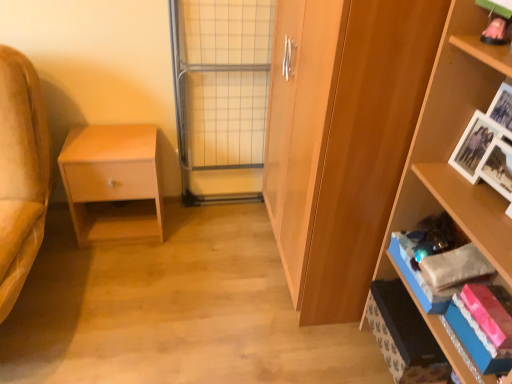
This screenshot has width=512, height=384. I want to click on wooden shelf at right, so click(454, 144).

What is the approximate width of wooden cabinet at center?

wooden cabinet at center is 22.06 inches wide.

What do you see at coordinates (342, 140) in the screenshot? I see `wooden cabinet at center` at bounding box center [342, 140].

Locate an element on the screen. The width and height of the screenshot is (512, 384). wooden shelf at right is located at coordinates (454, 144).

Is wooden cabinet at center touching metal grid screen door at center?

No, wooden cabinet at center is not next to metal grid screen door at center.

Consider the image. Between wooden cabinet at center and metal grid screen door at center, which one has more height?

With more height is wooden cabinet at center.

Considering the positions of points (338, 235) and (224, 65), is point (338, 235) farther from camera compared to point (224, 65)?

No.

Could you tell me if wooden cabinet at center is facing metal grid screen door at center?

Yes, wooden cabinet at center is oriented towards metal grid screen door at center.

From the image's perspective, is blue cardboard box at lower right under matte wood nightstand at left?

Yes, from the image's perspective, blue cardboard box at lower right is below matte wood nightstand at left.

Would you consider blue cardboard box at lower right to be distant from matte wood nightstand at left?

Yes, blue cardboard box at lower right is far from matte wood nightstand at left.

Does point (369, 303) come in front of point (99, 202)?

Yes, it is.

Can you tell me how much blue cardboard box at lower right and matte wood nightstand at left differ in facing direction?

The angular difference between blue cardboard box at lower right and matte wood nightstand at left is 89.9 degrees.

Would you consider blue cardboard box at lower right to be distant from shiny pink book at lower right?

No, blue cardboard box at lower right is not far away from shiny pink book at lower right.

From the picture: Between blue cardboard box at lower right and shiny pink book at lower right, which one is positioned behind?

Positioned behind is blue cardboard box at lower right.

This screenshot has height=384, width=512. Identify the location of book above the blue cardboard box at lower right (from a real-world perspective). (483, 327).

Is matte wood nightstand at left turned away from metal grid screen door at center?

No, matte wood nightstand at left is not facing the opposite direction of metal grid screen door at center.

From the image's perspective, which is above, matte wood nightstand at left or metal grid screen door at center?

From the image's view, metal grid screen door at center is above.

Which is more to the left, matte wood nightstand at left or metal grid screen door at center?

Positioned to the left is matte wood nightstand at left.

Which is nearer, (501, 362) or (406, 382)?

Positioned in front is point (501, 362).

From a real-world perspective, which object rests below the other?

blue cardboard box at lower right is physically lower.

Consider the image. Is shiny pink book at lower right spatially inside blue cardboard box at lower right, or outside of it?

shiny pink book at lower right is spatially situated outside blue cardboard box at lower right.

How many degrees apart are the facing directions of shiny pink book at lower right and blue cardboard box at lower right?

The angular difference between shiny pink book at lower right and blue cardboard box at lower right is 0.000143 degrees.

Is wooden cabinet at center facing towards wooden shelf at right?

No, wooden cabinet at center is not facing towards wooden shelf at right.

Which is more to the right, wooden cabinet at center or wooden shelf at right?

wooden shelf at right.

From a real-world perspective, is wooden cabinet at center on wooden shelf at right?

Incorrect, from a real-world perspective, wooden cabinet at center is lower than wooden shelf at right.

How many degrees apart are the facing directions of wooden cabinet at center and wooden shelf at right?

The facing directions of wooden cabinet at center and wooden shelf at right are 0.000163 degrees apart.

Is wooden shelf at right inside the boundaries of matte wood nightstand at left, or outside?

wooden shelf at right is spatially situated outside matte wood nightstand at left.

Between wooden shelf at right and matte wood nightstand at left, which one has larger width?

Wider between the two is matte wood nightstand at left.

Does point (419, 214) appear closer or farther from the camera than point (93, 129)?

Point (419, 214) is positioned closer to the camera compared to point (93, 129).

Considering the positions of objects wooden shelf at right and matte wood nightstand at left in the image provided, who is more to the left, wooden shelf at right or matte wood nightstand at left?

Positioned to the left is matte wood nightstand at left.

Find the location of a particular element. cabinetry that appears in front of the metal grid screen door at center is located at coordinates (342, 140).

At what (x,y) coordinates should I click in order to perform the action: click on cabinet below the matte wood nightstand at left (from the image's perspective). Please return your answer as a coordinate pair (x, y). This screenshot has height=384, width=512. Looking at the image, I should click on (404, 336).

In the scene shown: From the image, which object appears to be nearer to shiny pink book at lower right, wooden shelf at right or metal grid screen door at center?

Based on the image, wooden shelf at right appears to be nearer to shiny pink book at lower right.

Considering their positions, is blue cardboard box at lower right positioned further to wooden shelf at right than metal grid screen door at center?

metal grid screen door at center.

Estimate the real-world distances between objects in this image. Which object is closer to wooden cabinet at center, shiny pink book at lower right or matte wood nightstand at left?

Among the two, shiny pink book at lower right is located nearer to wooden cabinet at center.

Which object lies further to the anchor point metal grid screen door at center, wooden shelf at right or matte wood nightstand at left?

The object further to metal grid screen door at center is wooden shelf at right.

Based on their spatial positions, is matte wood nightstand at left or blue cardboard box at lower right further from metal grid screen door at center?

Among the two, blue cardboard box at lower right is located further to metal grid screen door at center.

From the image, which object appears to be farther from matte wood nightstand at left, wooden shelf at right or blue cardboard box at lower right?

The object further to matte wood nightstand at left is wooden shelf at right.

Based on their spatial positions, is shiny pink book at lower right or metal grid screen door at center further from blue cardboard box at lower right?

Based on the image, metal grid screen door at center appears to be further to blue cardboard box at lower right.

From the image, which object appears to be farther from metal grid screen door at center, blue cardboard box at lower right or wooden cabinet at center?

blue cardboard box at lower right lies further to metal grid screen door at center than the other object.

The height and width of the screenshot is (384, 512). In order to click on cabinetry between wooden shelf at right and blue cardboard box at lower right along the z-axis in this screenshot , I will do `click(342, 140)`.

Identify the location of book that lies between wooden cabinet at center and blue cardboard box at lower right from top to bottom. Image resolution: width=512 pixels, height=384 pixels. (483, 327).

Locate an element on the screen. screen door between wooden shelf at right and matte wood nightstand at left from front to back is located at coordinates (220, 88).

Where is `shelf between wooden cabinet at center and shiny pink book at lower right from top to bottom`? This screenshot has height=384, width=512. shelf between wooden cabinet at center and shiny pink book at lower right from top to bottom is located at coordinates (454, 144).